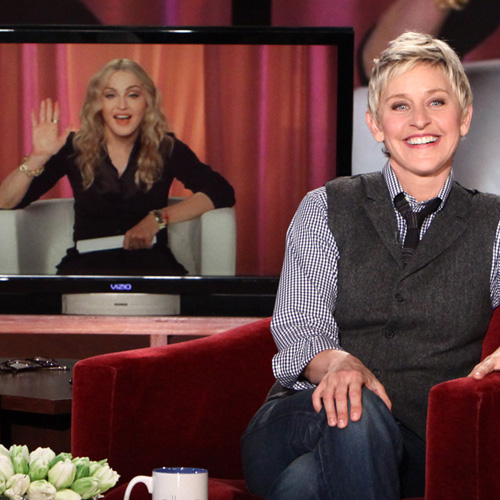
At what (x,y) coordinates should I click in order to perform the action: click on cherry wood shelf. Please return your answer as a coordinate pair (x, y). Looking at the image, I should click on (171, 325).